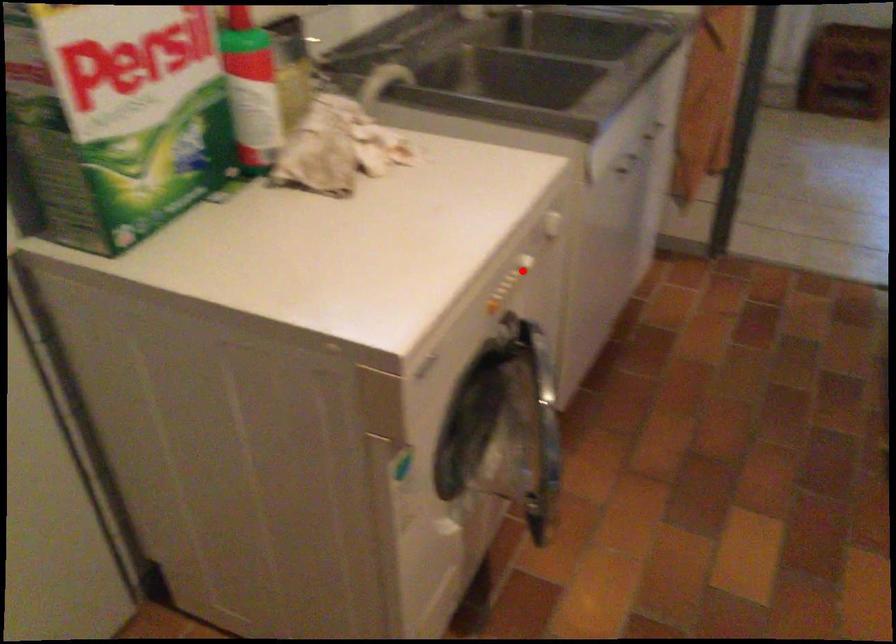
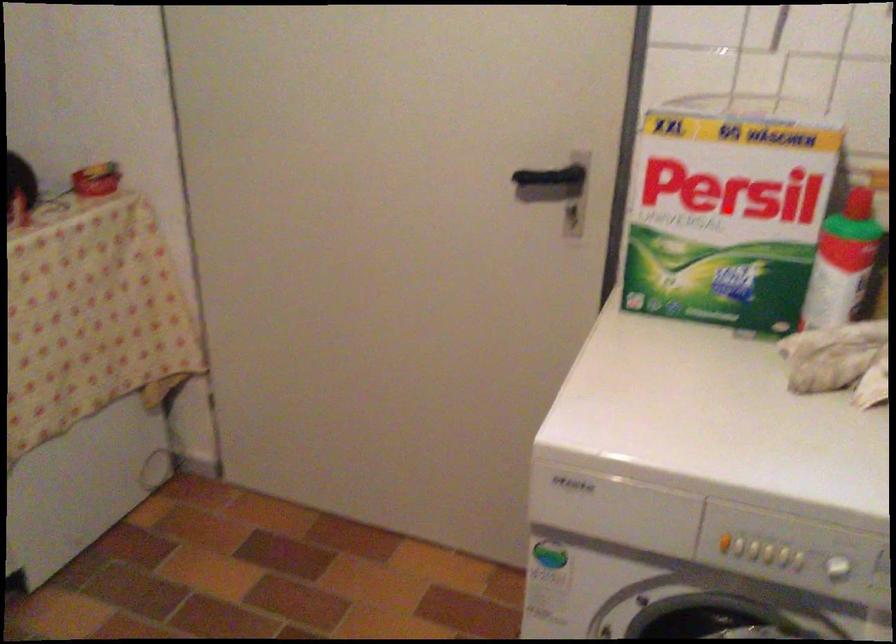
I am providing you with two images of the same scene from different viewpoints. A red point is marked on the first image and another point is marked on the second image. Is the marked point in image1 the same physical position as the marked point in image2?

No